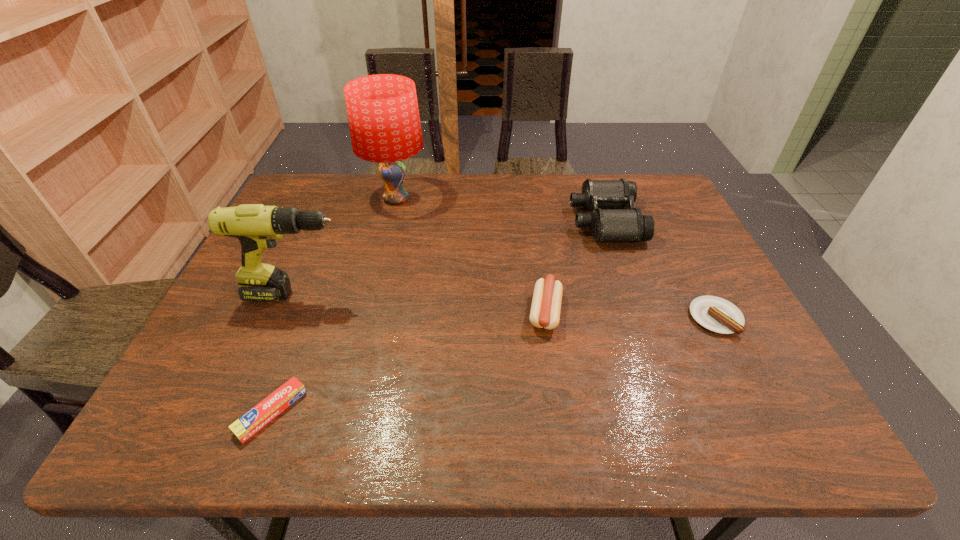
Identify the location of blank space at the right edge of the desktop. This screenshot has height=540, width=960. (695, 323).

The width and height of the screenshot is (960, 540). Identify the location of vacant space at the far right corner of the desktop. (665, 187).

This screenshot has width=960, height=540. What are the coordinates of `vacant point at the near right corner` in the screenshot? It's located at (759, 428).

Image resolution: width=960 pixels, height=540 pixels. I want to click on vacant space that is in between the rightmost object and the fifth shortest object, so click(507, 306).

At what (x,y) coordinates should I click in order to perform the action: click on vacant space that is in between the tallest object and the nearest object. Please return your answer as a coordinate pair (x, y). This screenshot has height=540, width=960. Looking at the image, I should click on (334, 306).

Identify the location of vacant space in between the second object from right to left and the nearest object. The height and width of the screenshot is (540, 960). (438, 316).

The height and width of the screenshot is (540, 960). In order to click on blank region between the third tallest object and the drill in this screenshot , I will do `click(452, 258)`.

At what (x,y) coordinates should I click in order to perform the action: click on free space between the tallest object and the fourth shortest object. Please return your answer as a coordinate pair (x, y). Image resolution: width=960 pixels, height=540 pixels. Looking at the image, I should click on (500, 210).

In order to click on free space between the binoculars and the drill in this screenshot , I will do `click(452, 258)`.

Locate an element on the screen. Image resolution: width=960 pixels, height=540 pixels. free space between the tallest object and the fourth object from left to right is located at coordinates (470, 255).